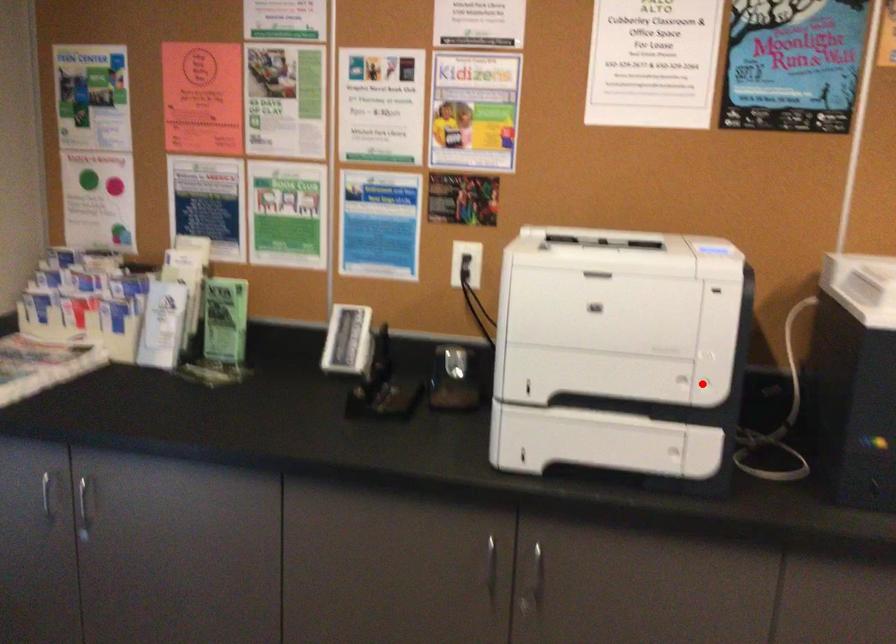
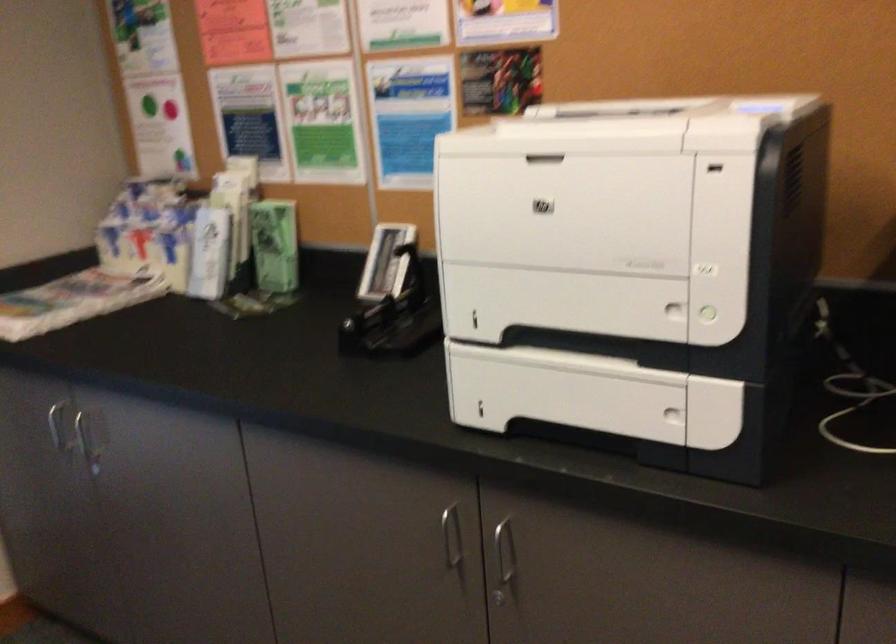
Where in the second image is the point corresponding to the highlighted location from the first image?

(709, 314)